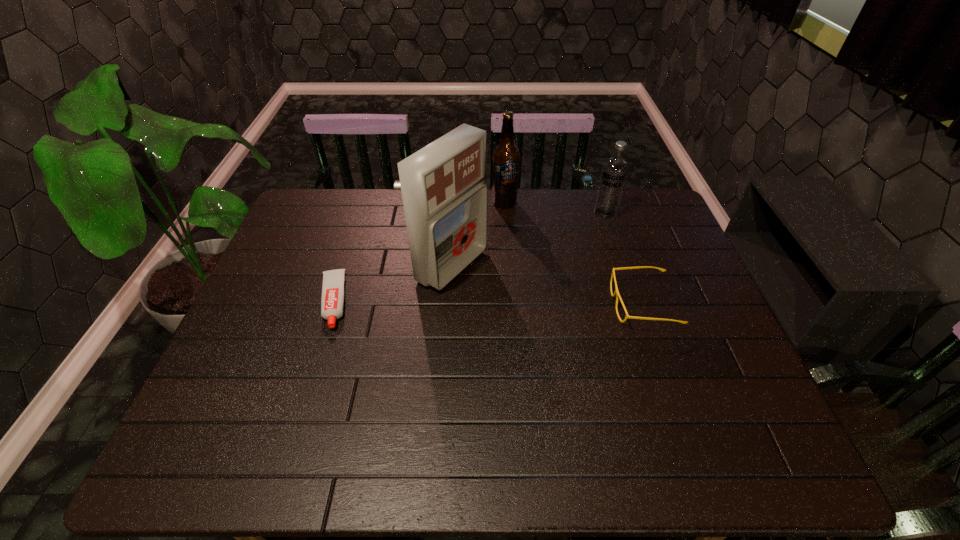
Where is `free space located 0.290m in front of the lenses of the spectacles`? The image size is (960, 540). free space located 0.290m in front of the lenses of the spectacles is located at coordinates (504, 304).

The width and height of the screenshot is (960, 540). Identify the location of free space located 0.080m in front of the lenses of the spectacles. (583, 304).

Identify the location of free region located on the front label of the vodka. Image resolution: width=960 pixels, height=540 pixels. (530, 288).

Find the location of `vacant space located 0.070m on the front label of the vodka`. vacant space located 0.070m on the front label of the vodka is located at coordinates (588, 230).

This screenshot has width=960, height=540. Find the location of `vacant region located on the front label of the vodka`. vacant region located on the front label of the vodka is located at coordinates (561, 258).

What are the coordinates of `free space located on the label of the beer bottle` in the screenshot? It's located at (516, 267).

Locate an element on the screen. The image size is (960, 540). vacant space located on the label of the beer bottle is located at coordinates (520, 298).

What are the coordinates of `free spot located 0.330m on the label of the beer bottle` in the screenshot? It's located at (517, 280).

The width and height of the screenshot is (960, 540). Find the location of `vacant point located on the front-facing side of the first-aid kit`. vacant point located on the front-facing side of the first-aid kit is located at coordinates (514, 300).

This screenshot has width=960, height=540. Find the location of `vacant space located 0.070m on the front-facing side of the first-aid kit`. vacant space located 0.070m on the front-facing side of the first-aid kit is located at coordinates (501, 293).